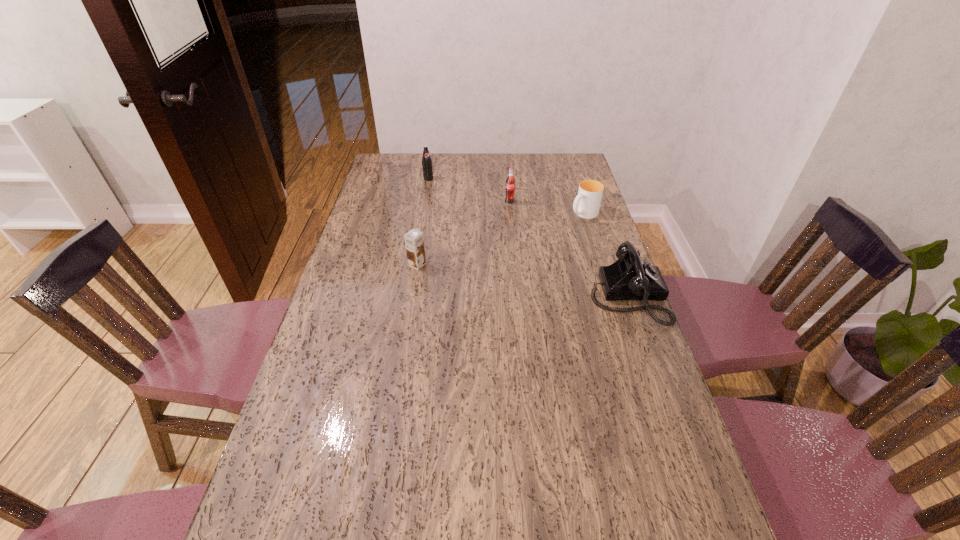
Image resolution: width=960 pixels, height=540 pixels. What are the coordinates of `chocolate milk` in the screenshot? It's located at (414, 243).

Identify the location of telephone. (629, 278).

Locate an element on the screen. The height and width of the screenshot is (540, 960). the second farthest object is located at coordinates (510, 182).

Identify the location of the right pop. This screenshot has height=540, width=960. (510, 182).

At what (x,y) coordinates should I click in order to perform the action: click on the farthest object. Please return your answer as a coordinate pair (x, y). This screenshot has width=960, height=540. Looking at the image, I should click on pos(427,167).

At what (x,y) coordinates should I click in order to perform the action: click on the farther pop. Please return your answer as a coordinate pair (x, y). The height and width of the screenshot is (540, 960). Looking at the image, I should click on (427, 167).

I want to click on cup, so click(587, 203).

Find the location of `the third nearest object`. the third nearest object is located at coordinates (587, 203).

Locate an element on the screen. The image size is (960, 540). free region located on the back of the chocolate milk is located at coordinates (420, 242).

Where is `vacant space located on the label of the nearer pop`? Image resolution: width=960 pixels, height=540 pixels. vacant space located on the label of the nearer pop is located at coordinates (537, 264).